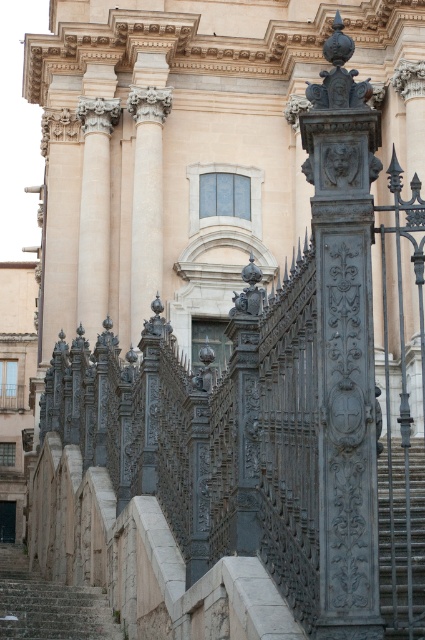
Question: Based on their relative distances, which object is nearer to the stone stairs at lower left?

Choices:
 (A) gray metallic column at right
 (B) dark gray stone stairs at lower right

Answer: (B)

Question: Does gray metallic column at right appear on the right side of dark gray stone stairs at lower right?

Choices:
 (A) no
 (B) yes

Answer: (A)

Question: Can you confirm if gray metallic column at right is positioned above dark gray stone stairs at lower right?

Choices:
 (A) no
 (B) yes

Answer: (B)

Question: Which point is farther to the camera?

Choices:
 (A) stone stairs at lower left
 (B) gray metallic column at right

Answer: (A)

Question: Which point appears farthest from the camera in this image?

Choices:
 (A) (308, 132)
 (B) (394, 448)

Answer: (B)

Question: Does gray metallic column at right lie in front of dark gray stone stairs at lower right?

Choices:
 (A) no
 (B) yes

Answer: (A)